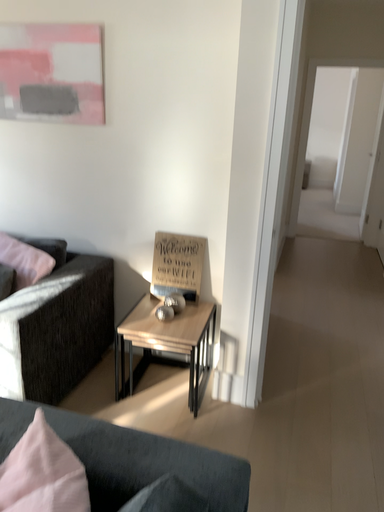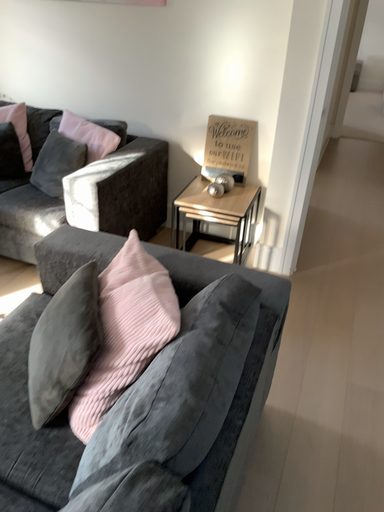
Question: Which way did the camera rotate in the video?

Choices:
 (A) rotated upward
 (B) rotated downward

Answer: (B)